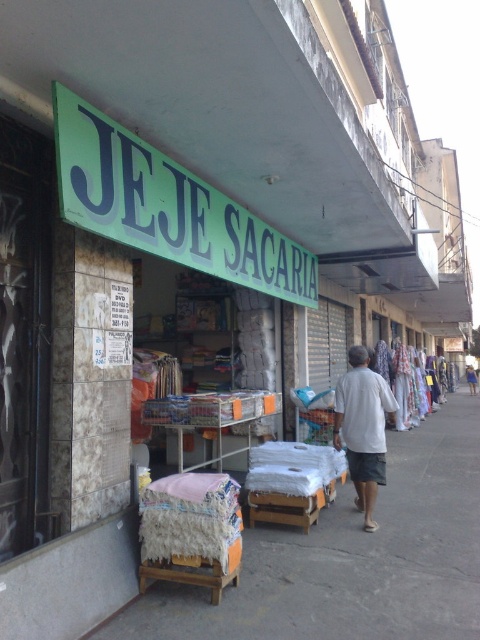
You are standing in front of the storefront and want to locate the green plastic sign at upper center. Can you tell me its exact coordinates?

The green plastic sign at upper center is located at coordinates point (168, 205).

You are a customer looking for the white cotton dress at center in the JEJE SACARIA store. Where should you look relative to the green plastic sign at upper center?

The white cotton dress at center is to the right of the green plastic sign at upper center.